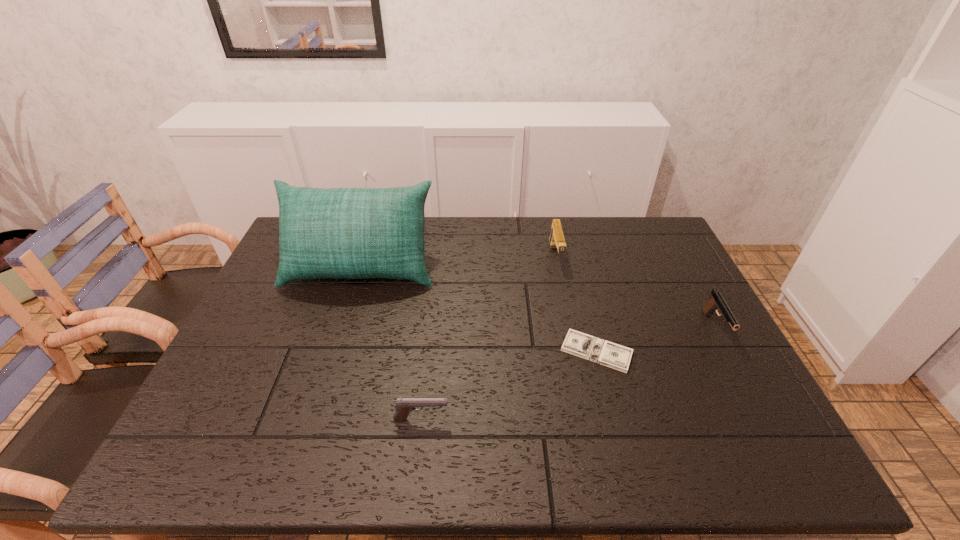
Image resolution: width=960 pixels, height=540 pixels. Identify the location of vacant region between the nearest pistol and the tallest object. (391, 343).

Where is `free spot between the cushion and the shortest object`? This screenshot has height=540, width=960. free spot between the cushion and the shortest object is located at coordinates (479, 309).

The image size is (960, 540). I want to click on free space that is in between the farthest pistol and the shortest object, so click(576, 304).

You are a GUI agent. You are given a task and a screenshot of the screen. Output one action in this format:
    pyautogui.click(x=<x>, y=<y>)
    Task: Click on the closest object to the leftmost pistol
    The image size is (960, 540).
    Given the screenshot: What is the action you would take?
    pyautogui.click(x=597, y=350)

You are a GUI agent. You are given a task and a screenshot of the screen. Output one action in this format:
    pyautogui.click(x=<x>, y=<y>)
    Task: Click on the object that is the fourth nearest to the rightmost pistol
    The width and height of the screenshot is (960, 540).
    Given the screenshot: What is the action you would take?
    pyautogui.click(x=348, y=233)

Identify which pistol is the nearest to the dollar. Please provide its 2D coordinates. Your answer should be formatted as a tuple, i.e. [(x, y)], where the tuple contains the x and y coordinates of a point satisfying the conditions above.

[(716, 302)]

You are a GUI agent. You are given a task and a screenshot of the screen. Output one action in this format:
    pyautogui.click(x=<x>, y=<y>)
    Task: Click on the pistol that can be found as the second closest to the second tallest object
    
    Given the screenshot: What is the action you would take?
    pyautogui.click(x=404, y=406)

Locate an element on the screen. vacant space that satisfies the following two spatial constraints: 1. on the front-facing side of the dollar; 2. on the left side of the tallest object is located at coordinates (334, 352).

Locate an element on the screen. Image resolution: width=960 pixels, height=540 pixels. free point that satisfies the following two spatial constraints: 1. at the muzzle of the second farthest pistol; 2. at the barrel of the nearest pistol is located at coordinates (764, 419).

You are a GUI agent. You are given a task and a screenshot of the screen. Output one action in this format:
    pyautogui.click(x=<x>, y=<y>)
    Task: Click on the vacant region that satisfies the following two spatial constraints: 1. at the muzzle of the rightmost pistol; 2. at the barrel of the leftmost pistol
    
    Given the screenshot: What is the action you would take?
    pyautogui.click(x=764, y=419)